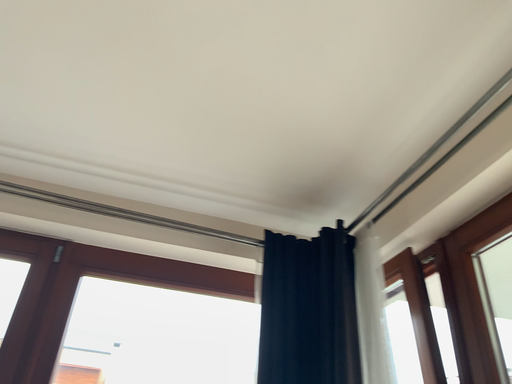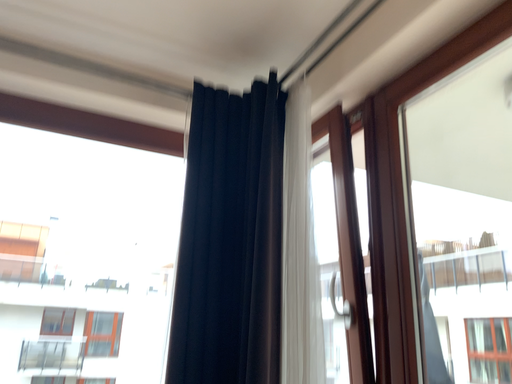
Question: How did the camera likely rotate when shooting the video?

Choices:
 (A) rotated upward
 (B) rotated downward

Answer: (B)